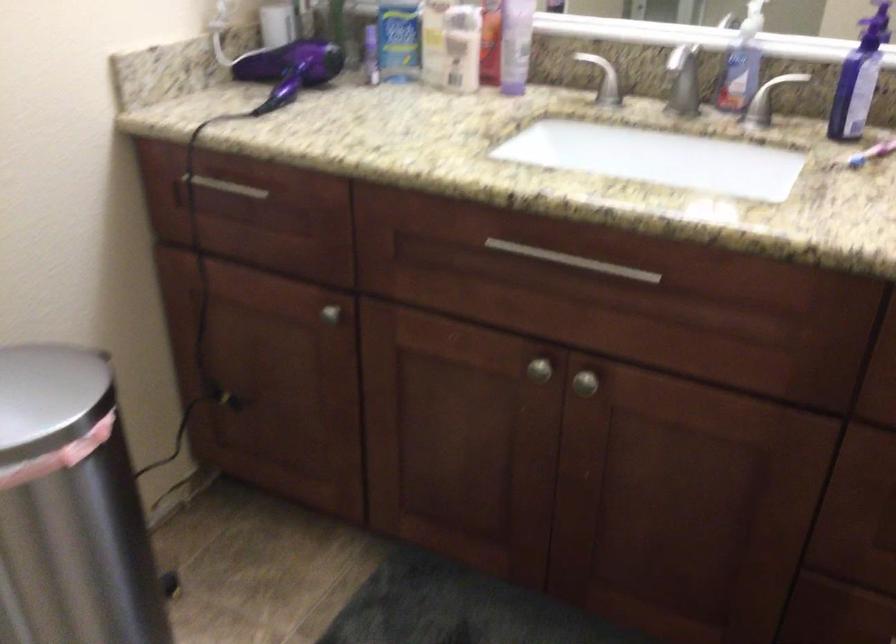
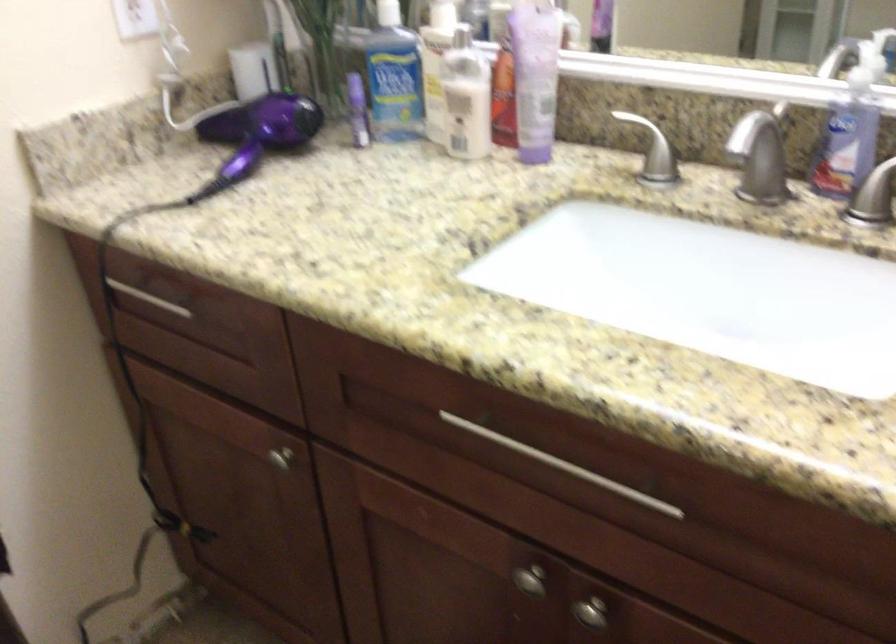
Question: The camera is either moving clockwise (left) or counter-clockwise (right) around the object. The first image is from the beginning of the video and the second image is from the end. Is the camera moving left or right when shooting the video?

Choices:
 (A) Left
 (B) Right

Answer: (B)